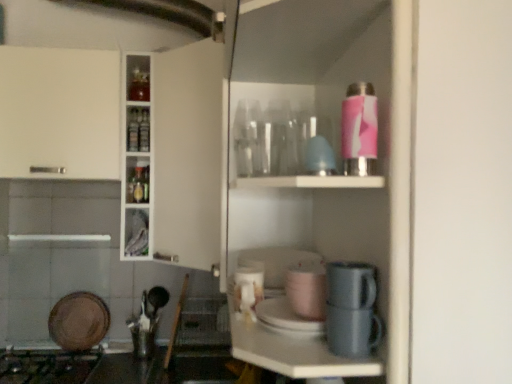
Locate an element on the screen. vacant space situated on the left part of brown matte plate at lower left, the 1th appliance in the bottom-to-top sequence is located at coordinates (40, 351).